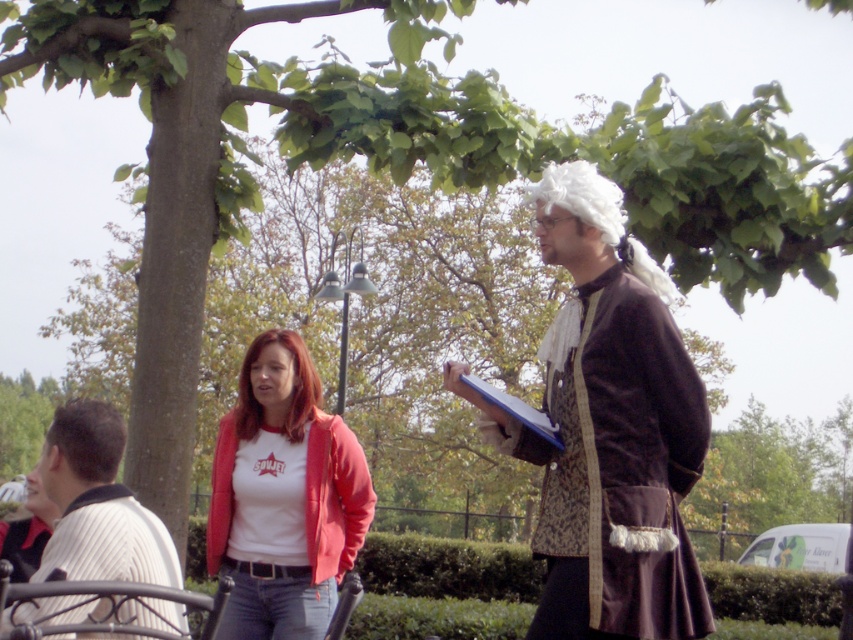
You are a photographer setting up for a group photo in the park. You notice the white textured shirt at left and the blue paper clipboard at right. Which object should you focus on first if you want to capture the taller object in your shot?

The white textured shirt at left is taller than the blue paper clipboard at right, so you should focus on the white textured shirt at left first.